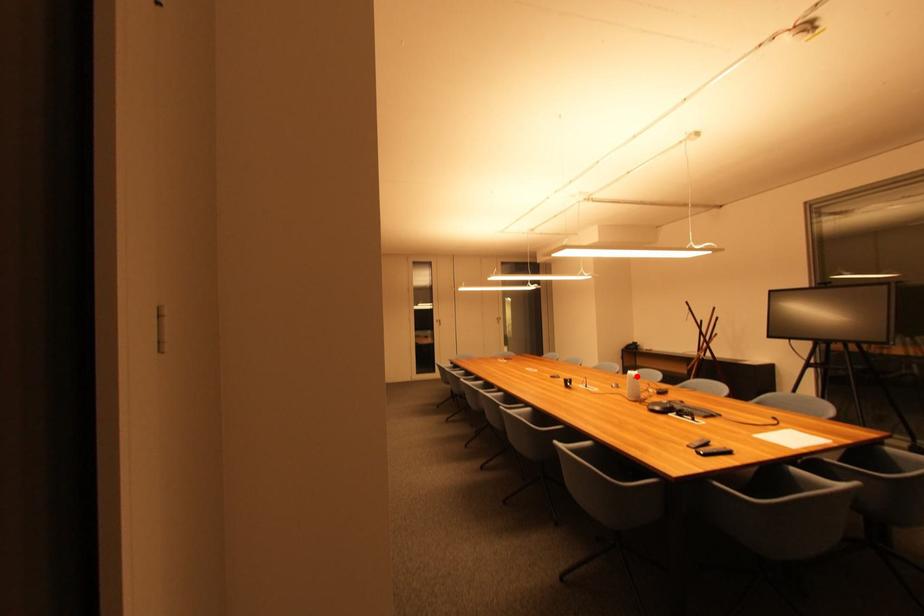
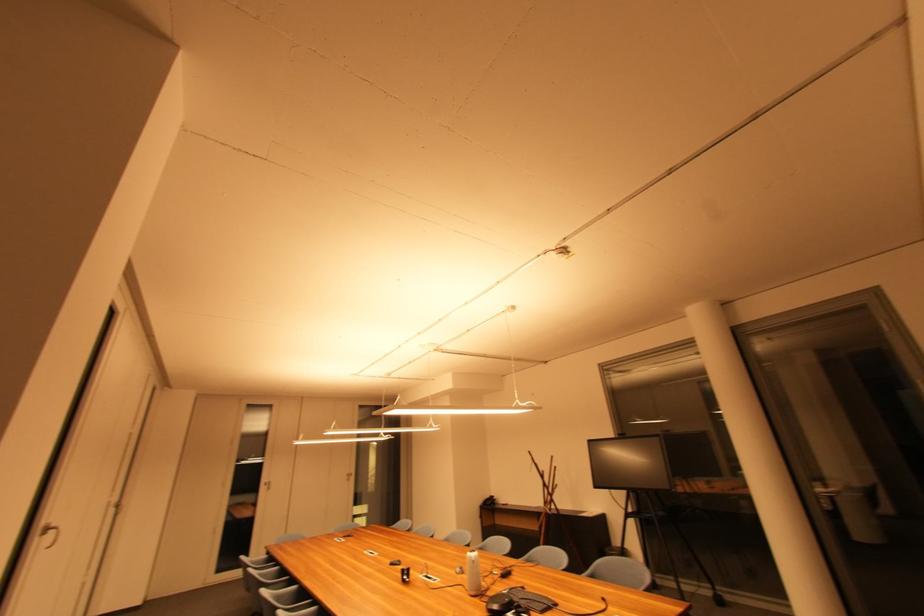
Where in the second image is the point corresponding to the highlighted location from the first image?

(477, 560)